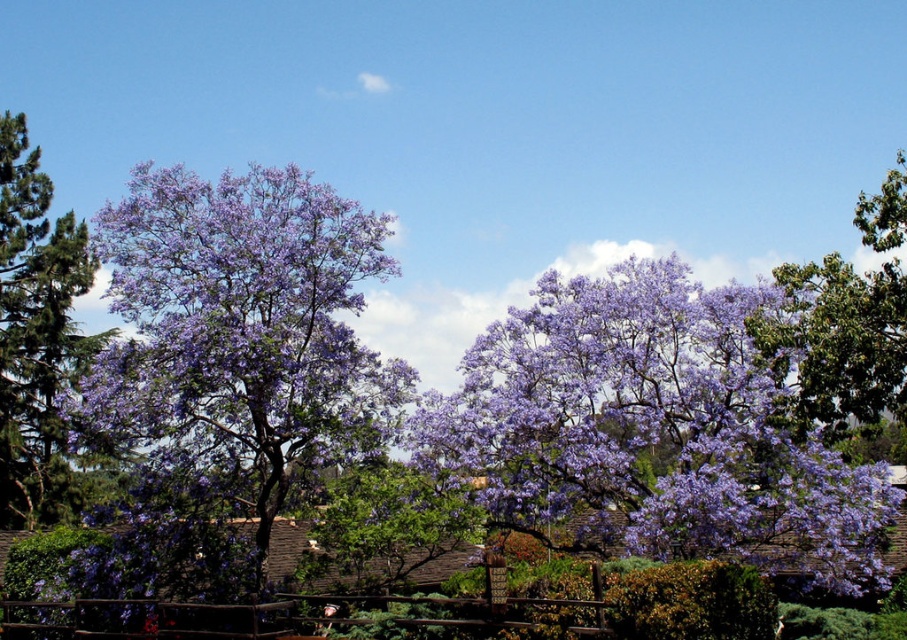
Does purple leafy tree at upper right have a lesser width compared to purple leafy tree at center?

In fact, purple leafy tree at upper right might be wider than purple leafy tree at center.

Between purple leafy tree at upper right and purple leafy tree at center, which one is positioned lower?

purple leafy tree at center is lower down.

Locate an element on the screen. purple leafy tree at upper right is located at coordinates coord(841,349).

Between point (163, 198) and point (784, 477), which one is positioned in front?

Positioned in front is point (784, 477).

Which is more to the left, purple leafy tree at left or purple matte flowers at center?

From the viewer's perspective, purple leafy tree at left appears more on the left side.

Describe the element at coordinates (230, 365) in the screenshot. I see `purple leafy tree at left` at that location.

The height and width of the screenshot is (640, 907). Find the location of `purple leafy tree at left`. purple leafy tree at left is located at coordinates (230, 365).

Does purple matte flowers at center appear on the right side of purple matte tree at left?

Correct, you'll find purple matte flowers at center to the right of purple matte tree at left.

Between purple matte flowers at center and purple matte tree at left, which one has less height?

purple matte flowers at center is shorter.

This screenshot has height=640, width=907. Identify the location of purple matte flowers at center. (652, 433).

You are a GUI agent. You are given a task and a screenshot of the screen. Output one action in this format:
    pyautogui.click(x=<x>, y=<y>)
    Task: Click on the purple matte flowers at center
    The image size is (907, 640).
    Given the screenshot: What is the action you would take?
    pyautogui.click(x=652, y=433)